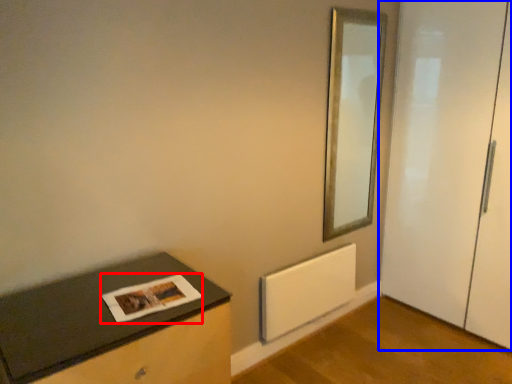
Question: Among these objects, which one is nearest to the camera, magazine (highlighted by a red box) or door (highlighted by a blue box)?

Choices:
 (A) magazine
 (B) door

Answer: (A)